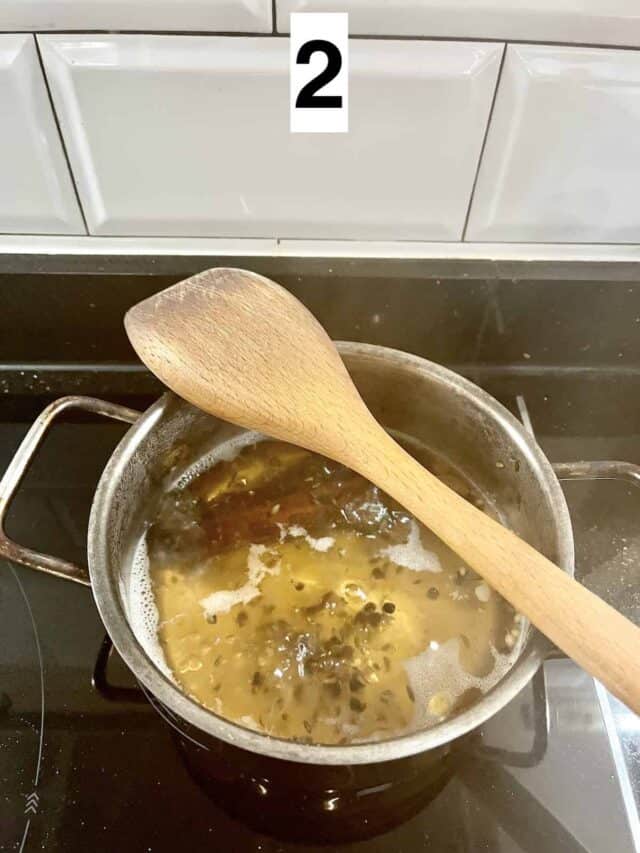
Find the location of a particular element. background, white subway title is located at coordinates (72, 7).